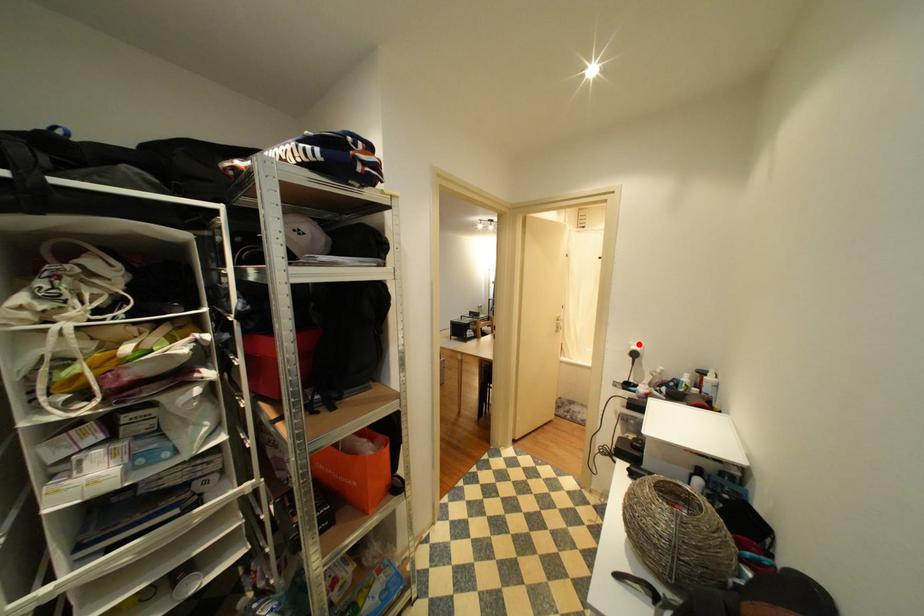
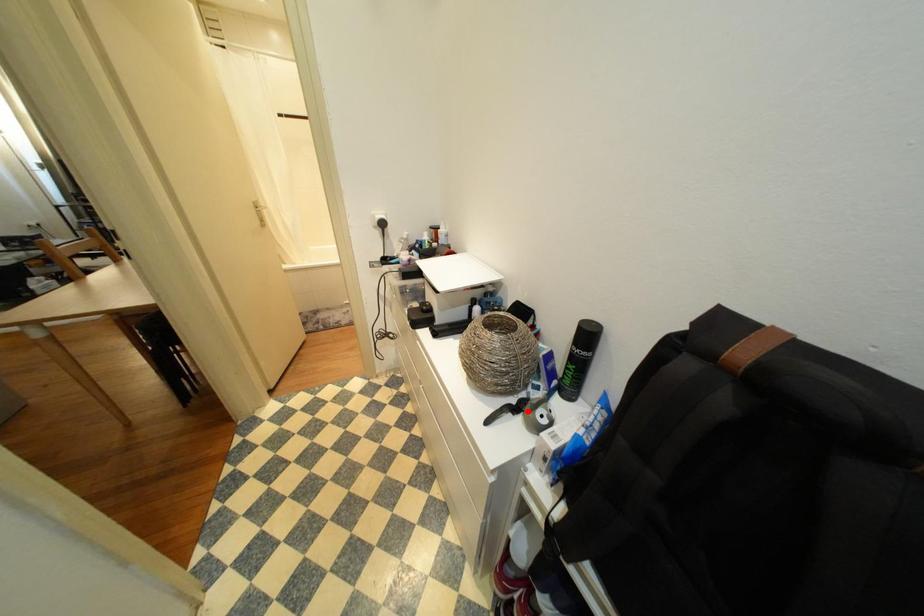
I am providing you with two images of the same scene from different viewpoints. A red point is marked on the first image and another point is marked on the second image. Is the red point in image1 aligned with the point shown in image2?

No